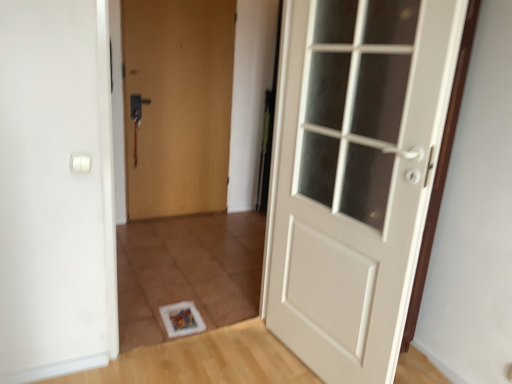
In order to face white glossy door at center, which is the first door from right to left, should I rotate leftwards or rightwards?

Turn right by 10.824 degrees to look at white glossy door at center, which is the first door from right to left.

Locate an element on the screen. The image size is (512, 384). white glossy door at center, which ranks as the 2th door in back-to-front order is located at coordinates tap(354, 176).

Describe the element at coordinates (354, 176) in the screenshot. I see `white glossy door at center, which is the first door from right to left` at that location.

What do you see at coordinates (178, 104) in the screenshot?
I see `matte wood door at center, which is the 1th door from back to front` at bounding box center [178, 104].

This screenshot has width=512, height=384. I want to click on matte wood door at center, which is the 1th door from back to front, so click(x=178, y=104).

Identify the location of white glossy door at center, which ranks as the first door in front-to-back order. Image resolution: width=512 pixels, height=384 pixels. (354, 176).

Consider the image. Can you confirm if white glossy door at center, which is the first door from right to left, is positioned to the left of matte wood door at center, which is the 2th door from right to left?

No, white glossy door at center, which is the first door from right to left, is not to the left of matte wood door at center, which is the 2th door from right to left.

Which object is closer to the camera, white glossy door at center, which is the first door from right to left, or matte wood door at center, arranged as the 1th door when viewed from the left?

Positioned in front is white glossy door at center, which is the first door from right to left.

Considering the positions of point (330, 123) and point (146, 73), is point (330, 123) closer or farther from the camera than point (146, 73)?

Clearly, point (330, 123) is closer to the camera than point (146, 73).

From the image's perspective, who appears lower, white glossy door at center, which is the first door from right to left, or matte wood door at center, which is the 1th door from back to front?

From the image's view, white glossy door at center, which is the first door from right to left, is below.

From a real-world perspective, which is physically above, white glossy door at center, which ranks as the 2th door in back-to-front order, or matte wood door at center, which is the 2th door from right to left?

From a 3D spatial view, matte wood door at center, which is the 2th door from right to left, is above.

Which of these two, white glossy door at center, which ranks as the first door in front-to-back order, or matte wood door at center, arranged as the 1th door when viewed from the left, is thinner?

matte wood door at center, arranged as the 1th door when viewed from the left.

In terms of height, does white glossy door at center, which is the first door from right to left, look taller or shorter compared to matte wood door at center, which is the 2th door from right to left?

Clearly, white glossy door at center, which is the first door from right to left, is shorter compared to matte wood door at center, which is the 2th door from right to left.

Considering the sizes of white glossy door at center, which ranks as the 2th door in back-to-front order, and matte wood door at center, arranged as the second door when viewed from the front, in the image, is white glossy door at center, which ranks as the 2th door in back-to-front order, bigger or smaller than matte wood door at center, arranged as the second door when viewed from the front,?

A: Considering their sizes, white glossy door at center, which ranks as the 2th door in back-to-front order, takes up more space than matte wood door at center, arranged as the second door when viewed from the front.

Is white glossy door at center, which ranks as the first door in front-to-back order, inside the boundaries of matte wood door at center, which is the 2th door from right to left, or outside?

white glossy door at center, which ranks as the first door in front-to-back order, is not enclosed by matte wood door at center, which is the 2th door from right to left.

Is there a large distance between white glossy door at center, which is the second door in left-to-right order, and matte wood door at center, arranged as the 1th door when viewed from the left?

Yes, white glossy door at center, which is the second door in left-to-right order, is far from matte wood door at center, arranged as the 1th door when viewed from the left.

Is white glossy door at center, which ranks as the first door in front-to-back order, turned away from matte wood door at center, arranged as the second door when viewed from the front?

No.

Measure the distance from white glossy door at center, which is the second door in left-to-right order, to matte wood door at center, which is the 1th door from back to front.

white glossy door at center, which is the second door in left-to-right order, and matte wood door at center, which is the 1th door from back to front, are 6.58 feet apart.

You are a GUI agent. You are given a task and a screenshot of the screen. Output one action in this format:
    pyautogui.click(x=<x>, y=<y>)
    Task: Click on the door below the matte wood door at center, arranged as the second door when viewed from the front (from the image's perspective)
    This screenshot has height=384, width=512.
    Given the screenshot: What is the action you would take?
    pyautogui.click(x=354, y=176)

Is matte wood door at center, which is the 2th door from right to left, to the right of white glossy door at center, which is the first door from right to left, from the viewer's perspective?

No.

Is matte wood door at center, arranged as the second door when viewed from the front, in front of or behind white glossy door at center, which ranks as the first door in front-to-back order, in the image?

matte wood door at center, arranged as the second door when viewed from the front, is behind white glossy door at center, which ranks as the first door in front-to-back order.

From the picture: Which is less distant, (220, 94) or (394, 201)?

Point (394, 201)

From the image's perspective, which one is positioned lower, matte wood door at center, which is the 2th door from right to left, or white glossy door at center, which is the first door from right to left?

white glossy door at center, which is the first door from right to left, is shown below in the image.

From a real-world perspective, is matte wood door at center, which is the 1th door from back to front, on top of white glossy door at center, which ranks as the 2th door in back-to-front order?

Correct, in the physical world, matte wood door at center, which is the 1th door from back to front, is higher than white glossy door at center, which ranks as the 2th door in back-to-front order.

Considering the sizes of objects matte wood door at center, arranged as the second door when viewed from the front, and white glossy door at center, which ranks as the 2th door in back-to-front order, in the image provided, who is thinner, matte wood door at center, arranged as the second door when viewed from the front, or white glossy door at center, which ranks as the 2th door in back-to-front order,?

Thinner between the two is matte wood door at center, arranged as the second door when viewed from the front.

In terms of height, does matte wood door at center, arranged as the 1th door when viewed from the left, look taller or shorter compared to white glossy door at center, which is the first door from right to left?

In the image, matte wood door at center, arranged as the 1th door when viewed from the left, appears to be taller than white glossy door at center, which is the first door from right to left.

Between matte wood door at center, which is the 1th door from back to front, and white glossy door at center, which ranks as the 2th door in back-to-front order, which one has smaller size?

matte wood door at center, which is the 1th door from back to front, is smaller.

Is matte wood door at center, which is the 2th door from right to left, positioned beyond the bounds of white glossy door at center, which ranks as the first door in front-to-back order?

That's correct, matte wood door at center, which is the 2th door from right to left, is outside of white glossy door at center, which ranks as the first door in front-to-back order.

Is matte wood door at center, arranged as the second door when viewed from the front, with white glossy door at center, which ranks as the first door in front-to-back order?

matte wood door at center, arranged as the second door when viewed from the front, and white glossy door at center, which ranks as the first door in front-to-back order, are not in contact.

Is matte wood door at center, which is the 2th door from right to left, oriented away from white glossy door at center, which ranks as the first door in front-to-back order?

No, matte wood door at center, which is the 2th door from right to left,'s orientation is not away from white glossy door at center, which ranks as the first door in front-to-back order.

I want to click on door located underneath the matte wood door at center, which is the 2th door from right to left (from a real-world perspective), so click(x=354, y=176).

I want to click on door in front of the matte wood door at center, arranged as the 1th door when viewed from the left, so click(x=354, y=176).

Find the location of a particular element. door that appears above the white glossy door at center, which ranks as the first door in front-to-back order (from the image's perspective) is located at coordinates (178, 104).